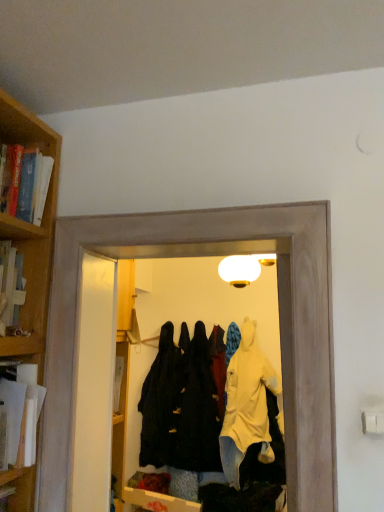
Question: Is white paper at left, acting as the first book starting from the bottom, positioned with its back to transparent plastic coat hanger at center?

Choices:
 (A) yes
 (B) no

Answer: (B)

Question: Is white paper at left, acting as the first book starting from the bottom, not within transparent plastic coat hanger at center?

Choices:
 (A) yes
 (B) no

Answer: (A)

Question: Does white paper at left, acting as the first book starting from the bottom, appear on the left side of transparent plastic coat hanger at center?

Choices:
 (A) yes
 (B) no

Answer: (A)

Question: Is white paper at left, acting as the first book starting from the bottom, bigger than transparent plastic coat hanger at center?

Choices:
 (A) no
 (B) yes

Answer: (A)

Question: Are white paper at left, acting as the first book starting from the bottom, and transparent plastic coat hanger at center making contact?

Choices:
 (A) yes
 (B) no

Answer: (B)

Question: Which is correct: dark matte coat at center, marked as the 3th clothing in a back-to-front arrangement, is inside hardcover book at left, the 1th book in the top-to-bottom sequence, or outside of it?

Choices:
 (A) inside
 (B) outside

Answer: (B)

Question: Is dark matte coat at center, which is the 1th clothing from front to back, wider or thinner than hardcover book at left, the 1th book in the top-to-bottom sequence?

Choices:
 (A) thin
 (B) wide

Answer: (A)

Question: From the image's perspective, is dark matte coat at center, marked as the 3th clothing in a back-to-front arrangement, positioned above or below hardcover book at left, the 1th book in the top-to-bottom sequence?

Choices:
 (A) above
 (B) below

Answer: (B)

Question: Is point (177, 377) closer or farther from the camera than point (36, 166)?

Choices:
 (A) farther
 (B) closer

Answer: (A)

Question: From a real-world perspective, is white paper at left, which appears as the 2th book when viewed from the top, positioned above or below transparent plastic coat hanger at center?

Choices:
 (A) below
 (B) above

Answer: (A)

Question: Based on their sizes in the image, would you say white paper at left, which appears as the 2th book when viewed from the top, is bigger or smaller than transparent plastic coat hanger at center?

Choices:
 (A) small
 (B) big

Answer: (A)

Question: Looking at their shapes, would you say white paper at left, acting as the first book starting from the bottom, is wider or thinner than transparent plastic coat hanger at center?

Choices:
 (A) wide
 (B) thin

Answer: (A)

Question: Is white paper at left, acting as the first book starting from the bottom, inside or outside of transparent plastic coat hanger at center?

Choices:
 (A) outside
 (B) inside

Answer: (A)

Question: From their relative heights in the image, would you say black matte coat at center, the third clothing viewed from the front, is taller or shorter than dark matte coat at center, which is the 1th clothing from front to back?

Choices:
 (A) short
 (B) tall

Answer: (B)

Question: Is point 173,437 closer or farther from the camera than point 236,390?

Choices:
 (A) closer
 (B) farther

Answer: (A)